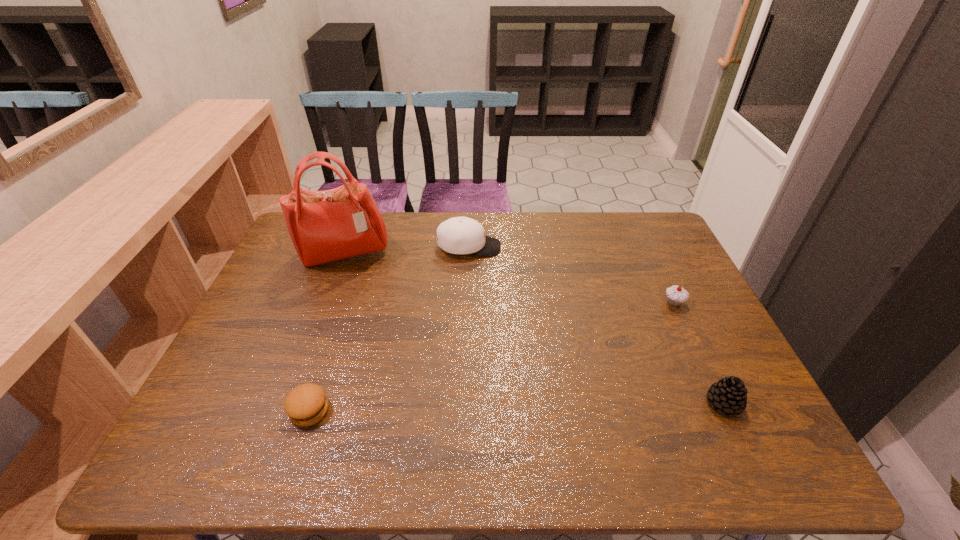
In order to click on the tallest object in this screenshot , I will do `click(325, 226)`.

In order to click on the third object from left to right in this screenshot , I will do `click(459, 235)`.

Where is `the third farthest object`? The width and height of the screenshot is (960, 540). the third farthest object is located at coordinates (676, 295).

In order to click on pinecone in this screenshot , I will do `click(729, 395)`.

Where is `hamburger`? The width and height of the screenshot is (960, 540). hamburger is located at coordinates point(307,404).

At what (x,y) coordinates should I click in order to perform the action: click on free space located on the front-facing side of the handbag. Please return your answer as a coordinate pair (x, y). This screenshot has height=540, width=960. Looking at the image, I should click on (330, 292).

This screenshot has width=960, height=540. Identify the location of vacant space located on the front-facing side of the third object from left to right. (589, 247).

Find the location of a particular element. The width and height of the screenshot is (960, 540). blank space located on the front of the cupcake is located at coordinates (715, 390).

Image resolution: width=960 pixels, height=540 pixels. What are the coordinates of `vacant space positioned 0.070m at the narrow end of the pinecone` in the screenshot? It's located at 745,450.

Identify the location of vacant region located on the right of the hamburger. This screenshot has height=540, width=960. (441, 410).